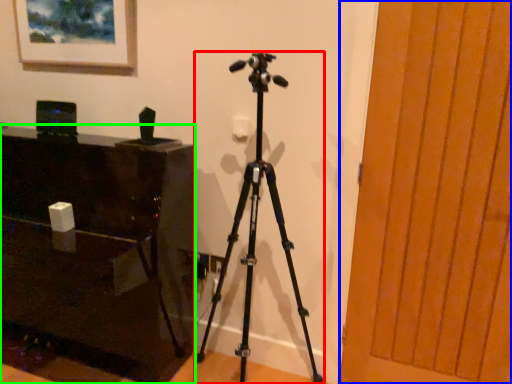
Question: Based on their relative distances, which object is farther from tripod (highlighted by a red box)? Choose from glass door (highlighted by a blue box) and furniture (highlighted by a green box).

Choices:
 (A) glass door
 (B) furniture

Answer: (A)